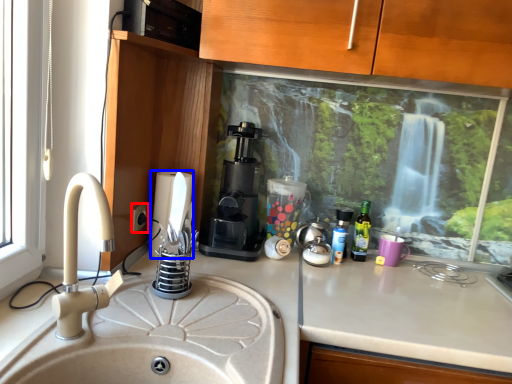
Question: Which of the following is the closest to the observer, electric outlet (highlighted by a red box) or appliance (highlighted by a blue box)?

Choices:
 (A) electric outlet
 (B) appliance

Answer: (A)